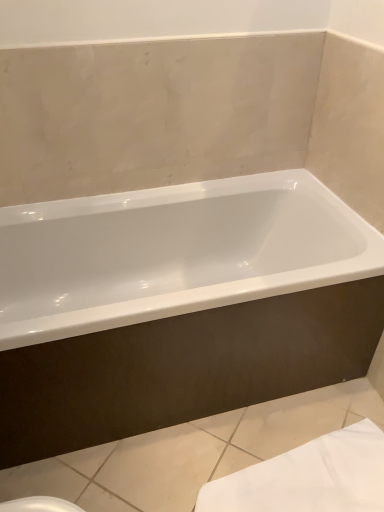
Question: Is point (48, 344) closer or farther from the camera than point (266, 481)?

Choices:
 (A) farther
 (B) closer

Answer: (B)

Question: Is white glossy bathtub at center inside the boundaries of white fabric towel at lower right, or outside?

Choices:
 (A) outside
 (B) inside

Answer: (A)

Question: Would you say white glossy bathtub at center is to the left or to the right of white fabric towel at lower right in the picture?

Choices:
 (A) right
 (B) left

Answer: (B)

Question: Visually, is white fabric towel at lower right positioned to the left or to the right of white glossy bathtub at center?

Choices:
 (A) left
 (B) right

Answer: (B)

Question: Would you say white fabric towel at lower right is inside or outside white glossy bathtub at center?

Choices:
 (A) outside
 (B) inside

Answer: (A)

Question: In terms of size, does white fabric towel at lower right appear bigger or smaller than white glossy bathtub at center?

Choices:
 (A) big
 (B) small

Answer: (B)

Question: From the image's perspective, relative to white glossy bathtub at center, is white fabric towel at lower right above or below?

Choices:
 (A) above
 (B) below

Answer: (B)